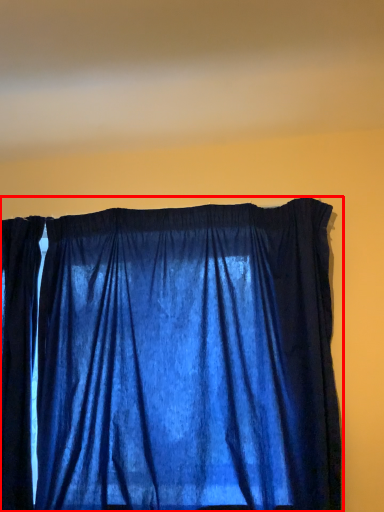
Question: From the image's perspective, considering the relative positions of curtain (annotated by the red box) and blind in the image provided, where is curtain (annotated by the red box) located with respect to the staircase?

Choices:
 (A) above
 (B) below

Answer: (B)